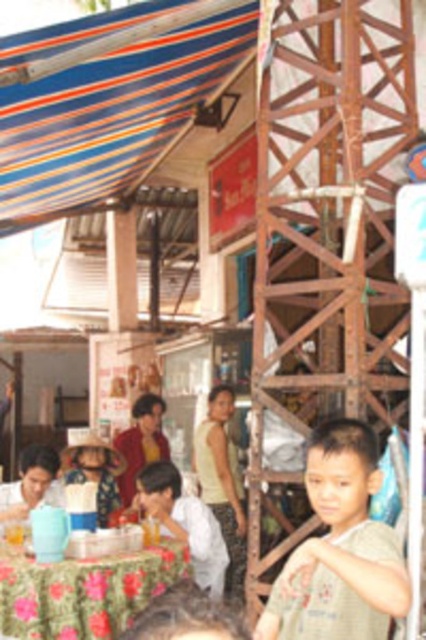
Question: Is light brown cotton shirt at center below floral fabric table at lower left?

Choices:
 (A) no
 (B) yes

Answer: (A)

Question: Estimate the real-world distances between objects in this image. Which object is closer to the light brown cotton shirt at center?

Choices:
 (A) white cotton shirt at lower center
 (B) floral fabric table at lower left

Answer: (B)

Question: Where is light brown cotton shirt at center located in relation to white cotton shirt at lower center in the image?

Choices:
 (A) below
 (B) above

Answer: (B)

Question: Which point is closer to the camera?

Choices:
 (A) (97, 620)
 (B) (210, 586)

Answer: (A)

Question: Is floral fabric table at lower left further to the viewer compared to white cotton shirt at lower center?

Choices:
 (A) yes
 (B) no

Answer: (B)

Question: Estimate the real-world distances between objects in this image. Which object is closer to the floral fabric table at lower left?

Choices:
 (A) light brown cotton shirt at center
 (B) white cotton shirt at lower center

Answer: (B)